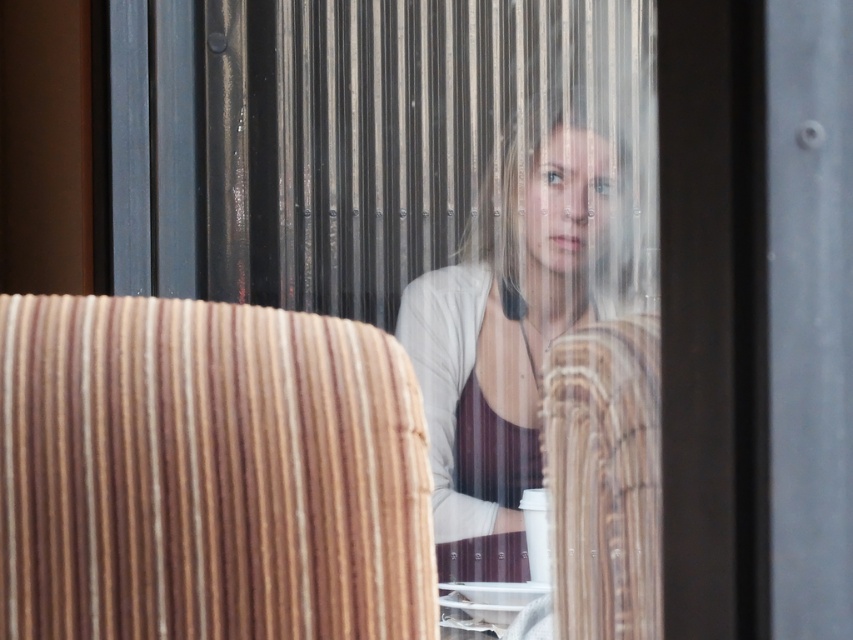
Which is more to the right, wooden ribbed armchair at center or matte white shirt at center?

matte white shirt at center is more to the right.

I want to click on wooden ribbed armchair at center, so click(x=207, y=474).

What do you see at coordinates (207, 474) in the screenshot?
I see `wooden ribbed armchair at center` at bounding box center [207, 474].

The image size is (853, 640). Identify the location of wooden ribbed armchair at center. (207, 474).

Does point (96, 486) come in front of point (631, 544)?

Yes, point (96, 486) is in front of point (631, 544).

Which is more to the left, wooden ribbed armchair at center or wooden armchair at center?

From the viewer's perspective, wooden ribbed armchair at center appears more on the left side.

Looking at this image, measure the distance between point [106,636] and camera.

94.90 centimeters

You are a GUI agent. You are given a task and a screenshot of the screen. Output one action in this format:
    pyautogui.click(x=<x>, y=<y>)
    Task: Click on the wooden ribbed armchair at center
    
    Given the screenshot: What is the action you would take?
    point(207,474)

Is point (610, 147) positioned before point (612, 387)?

No, it is behind (612, 387).

Which is more to the right, matte white shirt at center or wooden armchair at center?

wooden armchair at center

This screenshot has height=640, width=853. What are the coordinates of `matte white shirt at center` in the screenshot? It's located at (515, 321).